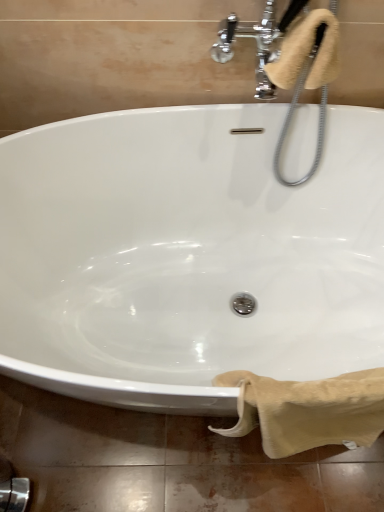
Question: From the image's perspective, is beige soft towel at upper right, the second bath towel positioned from the bottom, positioned above or below beige cotton towel at lower right, arranged as the 1th bath towel when ordered from the bottom?

Choices:
 (A) above
 (B) below

Answer: (A)

Question: Would you say beige soft towel at upper right, the second bath towel positioned from the bottom, is inside or outside beige cotton towel at lower right, arranged as the 1th bath towel when ordered from the bottom?

Choices:
 (A) outside
 (B) inside

Answer: (A)

Question: Does point click(299, 51) appear closer or farther from the camera than point click(375, 425)?

Choices:
 (A) farther
 (B) closer

Answer: (B)

Question: Do you think beige cotton towel at lower right, arranged as the 1th bath towel when ordered from the bottom, is within beige soft towel at upper right, which is the first bath towel from top to bottom, or outside of it?

Choices:
 (A) inside
 (B) outside

Answer: (B)

Question: Based on their sizes in the image, would you say beige cotton towel at lower right, arranged as the 1th bath towel when ordered from the bottom, is bigger or smaller than beige soft towel at upper right, which is the first bath towel from top to bottom?

Choices:
 (A) big
 (B) small

Answer: (A)

Question: Based on their positions, is beige cotton towel at lower right, which is the second bath towel in top-to-bottom order, located to the left or right of beige soft towel at upper right, the second bath towel positioned from the bottom?

Choices:
 (A) left
 (B) right

Answer: (B)

Question: From the image's perspective, is beige cotton towel at lower right, arranged as the 1th bath towel when ordered from the bottom, above or below beige soft towel at upper right, which is the first bath towel from top to bottom?

Choices:
 (A) below
 (B) above

Answer: (A)